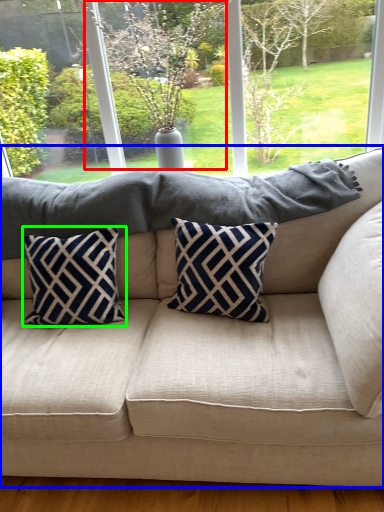
Question: Considering the real-world distances, which object is closest to tree (highlighted by a red box)? studio couch (highlighted by a blue box) or pillow (highlighted by a green box).

Choices:
 (A) studio couch
 (B) pillow

Answer: (B)